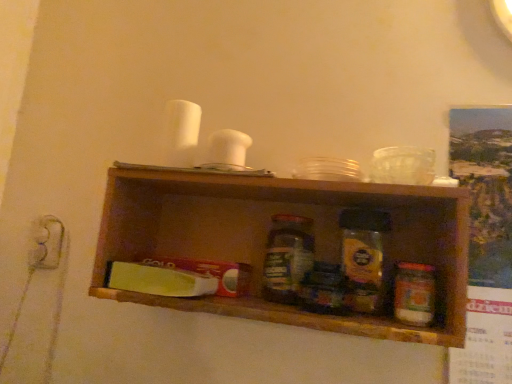
Question: From a real-world perspective, relative to wooden shelf at center, is translucent glass jar at center, positioned as the 2th bottle in front-to-back order, vertically above or below?

Choices:
 (A) below
 (B) above

Answer: (A)

Question: Considering the positions of translucent glass jar at center, positioned as the 2th bottle in front-to-back order, and wooden shelf at center in the image, is translucent glass jar at center, positioned as the 2th bottle in front-to-back order, wider or thinner than wooden shelf at center?

Choices:
 (A) wide
 (B) thin

Answer: (B)

Question: Which object is positioned closest to the green plastic butter at center?

Choices:
 (A) matte white electric outlet at left
 (B) wooden shelf at center
 (C) translucent glass jar at center
 (D) translucent glass jar at center, positioned as the 2th bottle in front-to-back order
 (E) translucent plastic jar at center-right, the 2th bottle viewed from the left

Answer: (D)

Question: Which is farther from the translucent glass jar at center, which appears as the first bottle when viewed from the left?

Choices:
 (A) matte white electric outlet at left
 (B) green plastic butter at center
 (C) translucent glass jar at center
 (D) translucent plastic jar at center-right, positioned as the first bottle in front-to-back order
 (E) wooden shelf at center

Answer: (A)